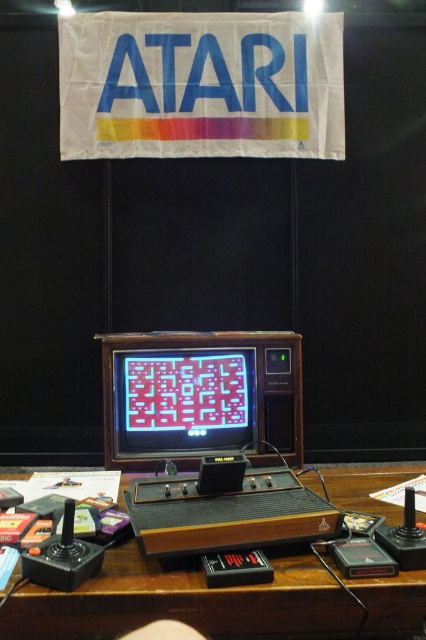
Question: Which object appears farthest from the camera in this image?

Choices:
 (A) matte plastic monitor at center
 (B) brown wood table at center

Answer: (A)

Question: Is brown wood table at center closer to camera compared to matte plastic monitor at center?

Choices:
 (A) yes
 (B) no

Answer: (A)

Question: Does brown wood table at center have a greater width compared to matte plastic monitor at center?

Choices:
 (A) no
 (B) yes

Answer: (B)

Question: Which point is farther to the camera?

Choices:
 (A) matte plastic monitor at center
 (B) brown wood table at center

Answer: (A)

Question: From the image, what is the correct spatial relationship of brown wood table at center in relation to matte plastic monitor at center?

Choices:
 (A) above
 (B) below

Answer: (B)